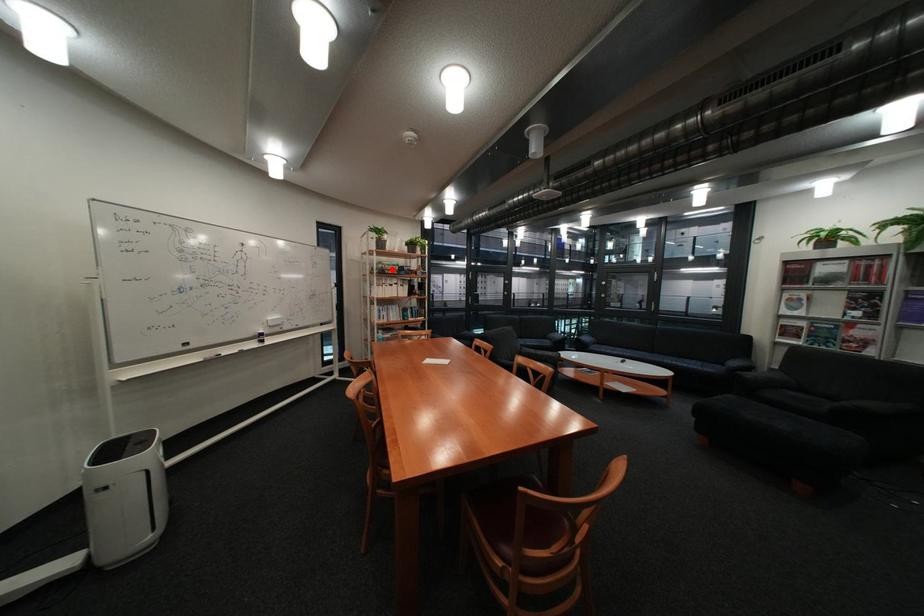
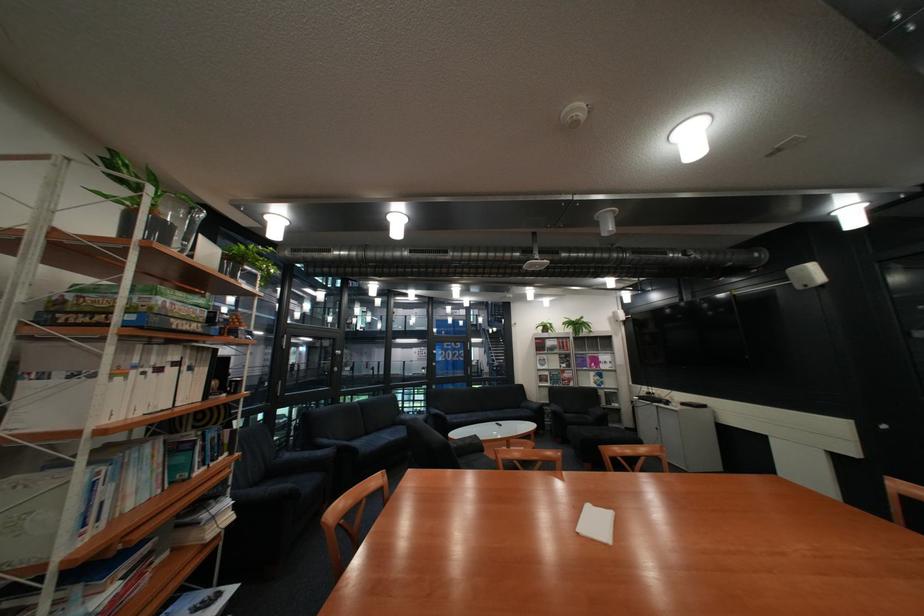
In the second image, find the point that corresponds to the highlighted location in the first image.

(141, 312)